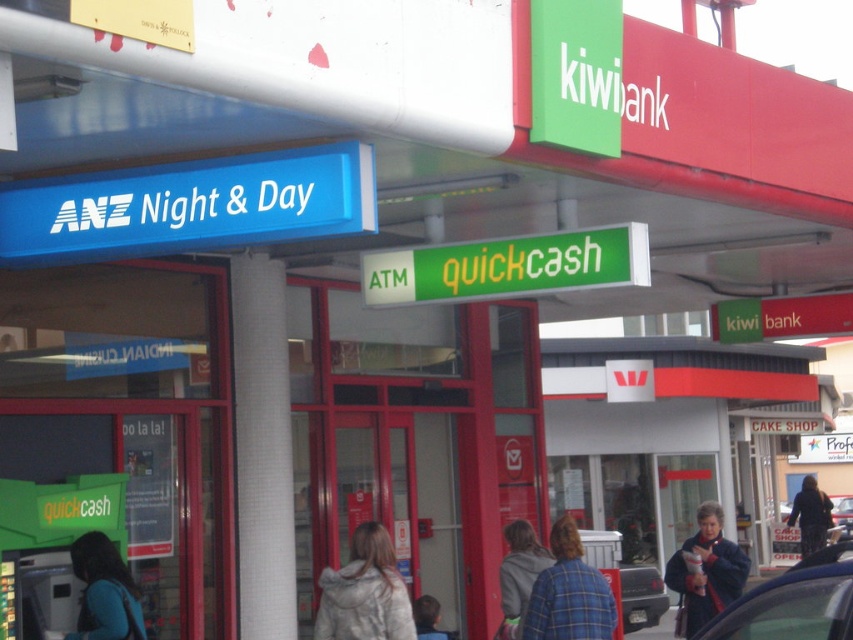
Does blue plaid shirt at lower center appear under light brown hair at lower center?

Actually, blue plaid shirt at lower center is above light brown hair at lower center.

Does blue plaid shirt at lower center appear on the right side of light brown hair at lower center?

Yes, blue plaid shirt at lower center is to the right of light brown hair at lower center.

The image size is (853, 640). In order to click on blue plaid shirt at lower center in this screenshot , I will do `click(569, 593)`.

Image resolution: width=853 pixels, height=640 pixels. What are the coordinates of `blue plaid shirt at lower center` in the screenshot? It's located at (569, 593).

Can you confirm if dark brown textured coat at lower right is wider than light brown hair at lower center?

Correct, the width of dark brown textured coat at lower right exceeds that of light brown hair at lower center.

Identify the location of dark brown textured coat at lower right. The width and height of the screenshot is (853, 640). (810, 515).

Locate an element on the screen. dark brown textured coat at lower right is located at coordinates (810, 515).

Which of these two, white fur coat at center or gray woolen jacket at center, stands shorter?

With less height is white fur coat at center.

Can you confirm if white fur coat at center is wider than gray woolen jacket at center?

Indeed, white fur coat at center has a greater width compared to gray woolen jacket at center.

Describe the element at coordinates (364, 593) in the screenshot. I see `white fur coat at center` at that location.

The image size is (853, 640). Identify the location of white fur coat at center. (364, 593).